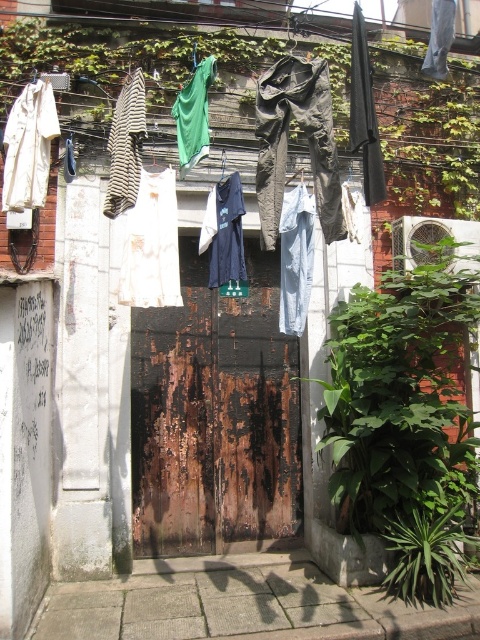
Question: Considering the real-world distances, which object is farthest from the dark gray fabric at center?

Choices:
 (A) rusty wood door at center
 (B) white cotton dress at center
 (C) striped fabric shirt at left

Answer: (A)

Question: Which of the following is the farthest from the observer?

Choices:
 (A) (109, 179)
 (B) (190, 86)
 (C) (213, 278)
 (D) (228, 428)

Answer: (D)

Question: Is rusty wood door at center thinner than denim jeans at center?

Choices:
 (A) no
 (B) yes

Answer: (A)

Question: Which point is farther from the camera taking this photo?

Choices:
 (A) (17, 104)
 (B) (148, 369)

Answer: (B)

Question: Is dark gray fabric at center wider than denim jeans at center?

Choices:
 (A) no
 (B) yes

Answer: (B)

Question: Does white cotton shirt at left appear on the right side of striped fabric shirt at left?

Choices:
 (A) yes
 (B) no

Answer: (B)